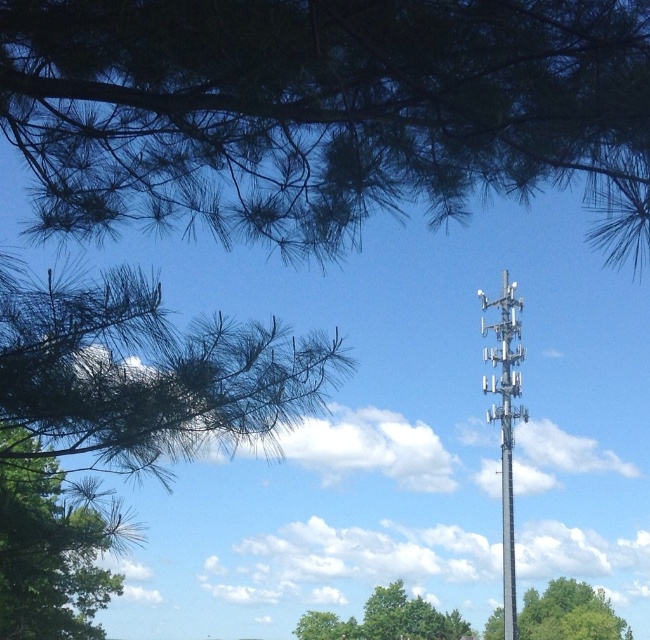
You are a photographer standing in the lower right area of the image, looking towards the upper right. You want to take a photo of the silver metallic pole at upper right but don want the green leafy tree at lower right to block the view. Is the pole visible from your position?

The silver metallic pole at upper right is located above the green leafy tree at lower right, so it should be visible from your position in the lower right area as it is positioned higher in the frame.

You are standing in the scene and want to determine the order of two points marked in the image. Which point, point [374,195] or point [504,573], is closer to you?

Point [374,195] is in front of point [504,573], so it is closer to you.